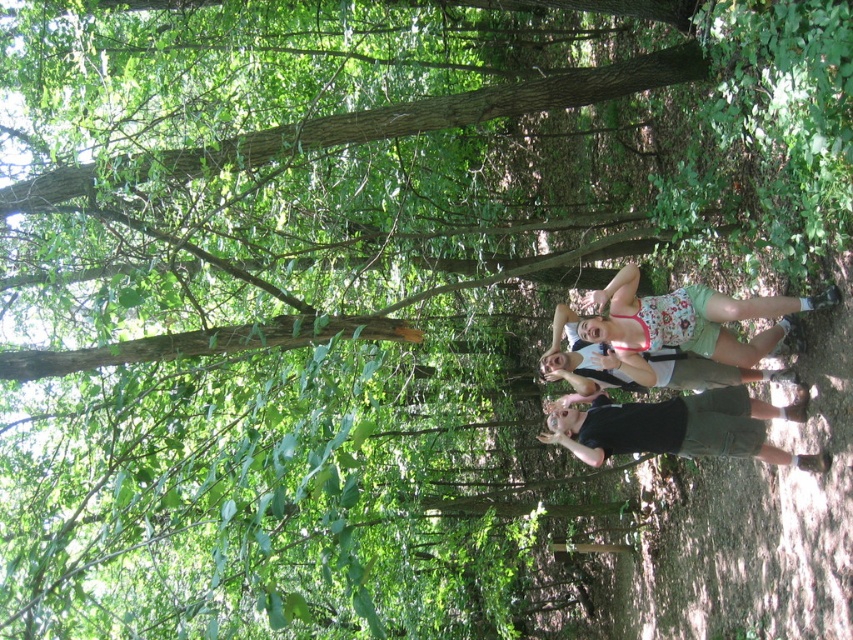
Question: Can you confirm if floral fabric shorts at center is positioned above black matte shorts at lower right?

Choices:
 (A) yes
 (B) no

Answer: (A)

Question: Which object is closer to the camera taking this photo?

Choices:
 (A) floral fabric shorts at center
 (B) black matte shorts at lower right

Answer: (A)

Question: Is floral fabric shorts at center thinner than black matte shorts at lower right?

Choices:
 (A) yes
 (B) no

Answer: (A)

Question: Can you confirm if floral fabric shorts at center is wider than black matte shorts at lower right?

Choices:
 (A) no
 (B) yes

Answer: (A)